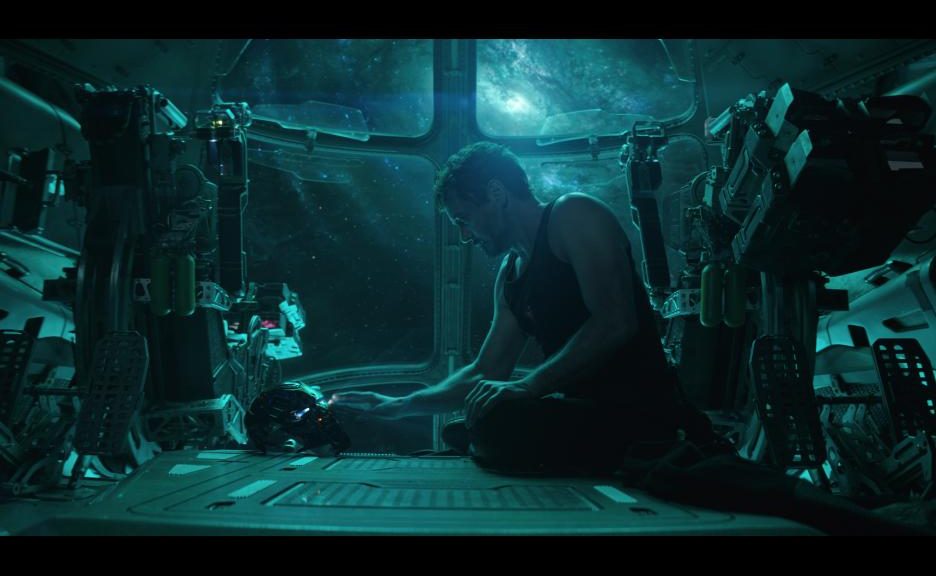
Where is `window`? Image resolution: width=936 pixels, height=576 pixels. window is located at coordinates (353, 274).